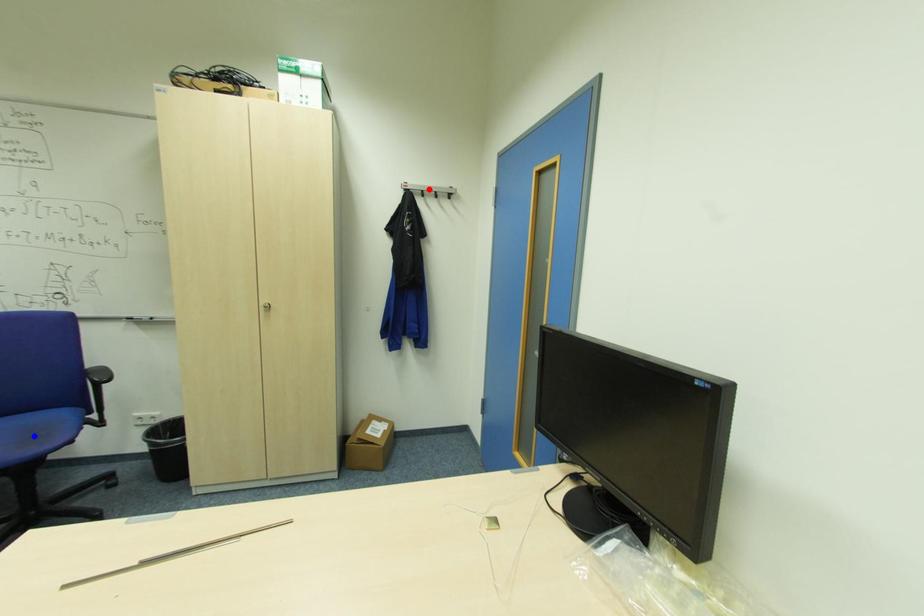
Question: Two points are marked on the image. Which point is closer to the camera?

Choices:
 (A) Blue point is closer.
 (B) Red point is closer.

Answer: (A)